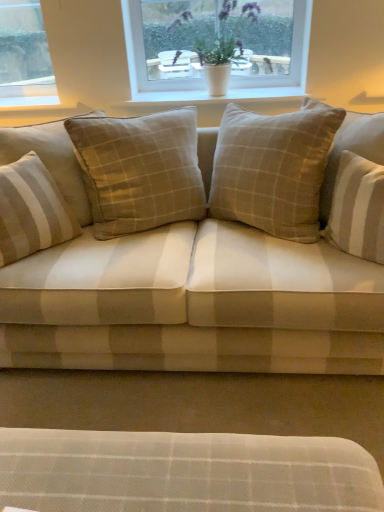
Identify the location of free spot above white smooth window sill at upper center (from a real-world perspective). The image size is (384, 512). (219, 94).